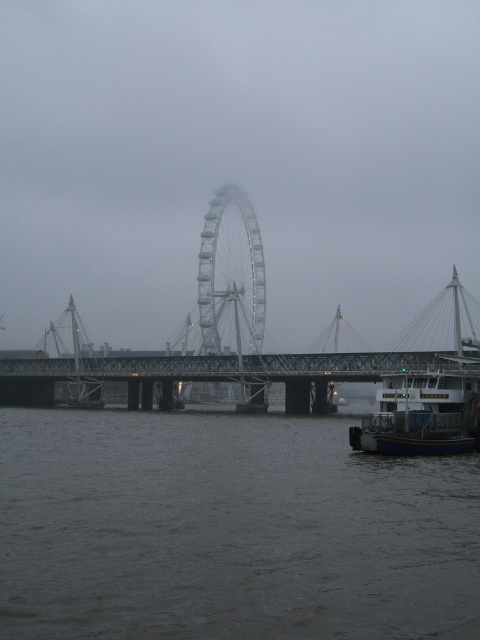
Question: Does metal ferris wheel at center have a greater width compared to blue metallic boat at lower right?

Choices:
 (A) yes
 (B) no

Answer: (A)

Question: Which point appears closest to the camera in this image?

Choices:
 (A) (371, 428)
 (B) (24, 358)

Answer: (A)

Question: Which object is the closest to the blue metallic boat at lower right?

Choices:
 (A) metal ferris wheel at center
 (B) metallic gray bridge at center
 (C) metallic bridge at center

Answer: (C)

Question: Is metal ferris wheel at center smaller than blue metallic boat at lower right?

Choices:
 (A) yes
 (B) no

Answer: (B)

Question: Considering the real-world distances, which object is closest to the blue metallic boat at lower right?

Choices:
 (A) gray water at lower center
 (B) metal ferris wheel at center
 (C) metallic bridge at center

Answer: (A)

Question: Is metallic gray bridge at center positioned behind blue metallic boat at lower right?

Choices:
 (A) no
 (B) yes

Answer: (B)